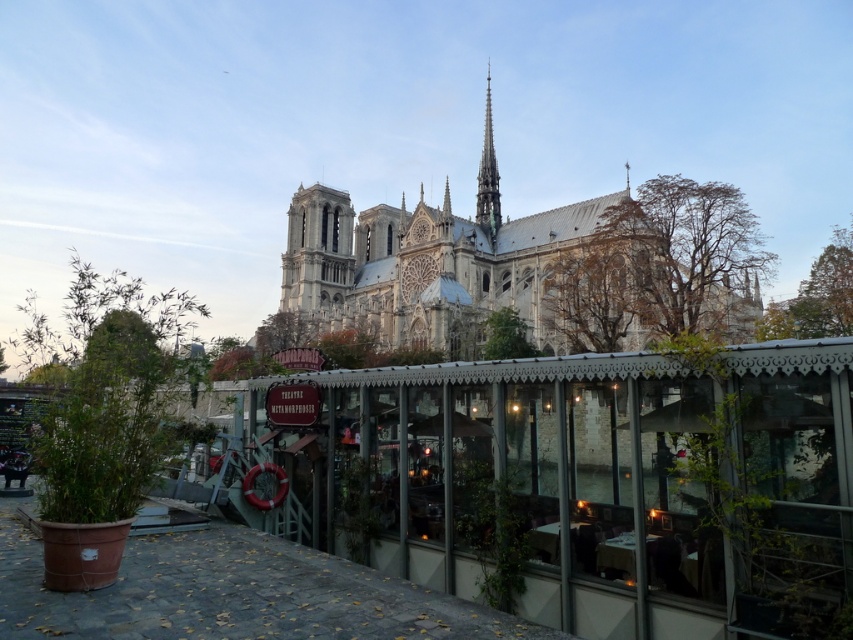
Question: Does white stone church at center appear over green copper spire at upper center?

Choices:
 (A) yes
 (B) no

Answer: (B)

Question: Does white stone church at center have a lesser width compared to green copper spire at upper center?

Choices:
 (A) no
 (B) yes

Answer: (A)

Question: Which point is closer to the camera?

Choices:
 (A) green copper spire at upper center
 (B) white stone church at center

Answer: (B)

Question: Among these points, which one is farthest from the camera?

Choices:
 (A) (488, 157)
 (B) (647, 198)

Answer: (A)

Question: Among these objects, which one is nearest to the camera?

Choices:
 (A) green copper spire at upper center
 (B) white stone church at center

Answer: (B)

Question: Considering the relative positions of white stone church at center and green copper spire at upper center in the image provided, where is white stone church at center located with respect to green copper spire at upper center?

Choices:
 (A) above
 (B) below

Answer: (B)